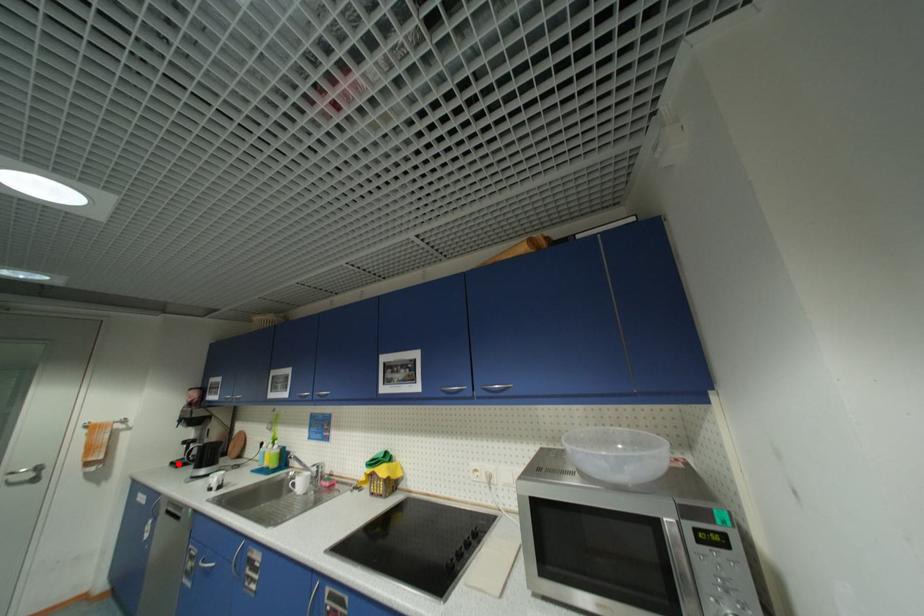
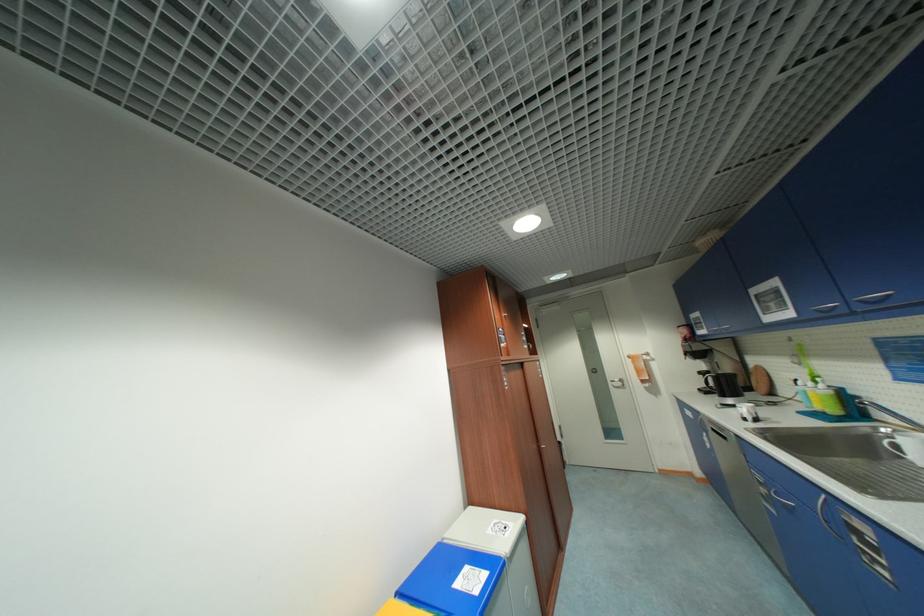
Where in the second image is the point corresponding to the highlighted location from the first image?

(706, 391)